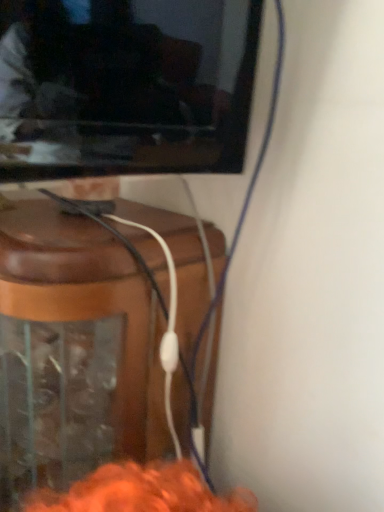
Image resolution: width=384 pixels, height=512 pixels. Describe the element at coordinates (90, 310) in the screenshot. I see `brown wood speaker at lower left` at that location.

I want to click on brown wood speaker at lower left, so click(90, 310).

Find the location of a particular element. brown wood speaker at lower left is located at coordinates (90, 310).